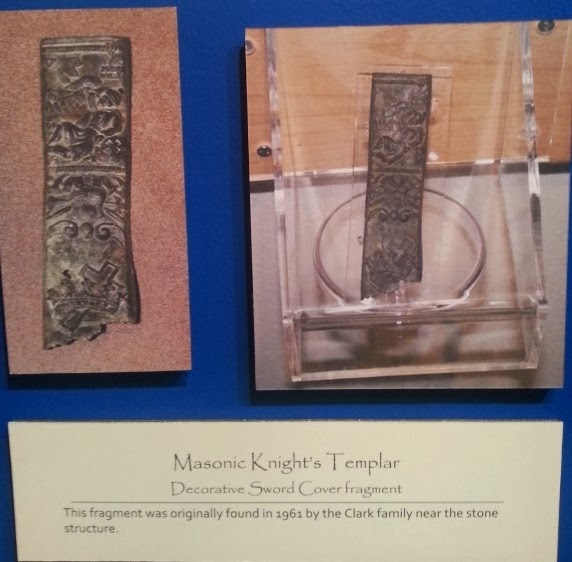
Find the location of a particular element. display case is located at coordinates (492, 225).